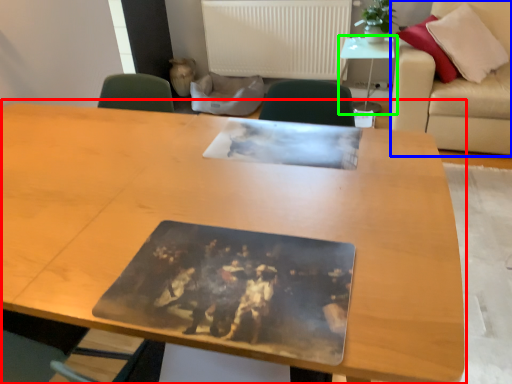
Question: Estimate the real-world distances between objects in this image. Which object is farther from table (highlighted by a red box), couch (highlighted by a blue box) or table (highlighted by a green box)?

Choices:
 (A) couch
 (B) table

Answer: (B)